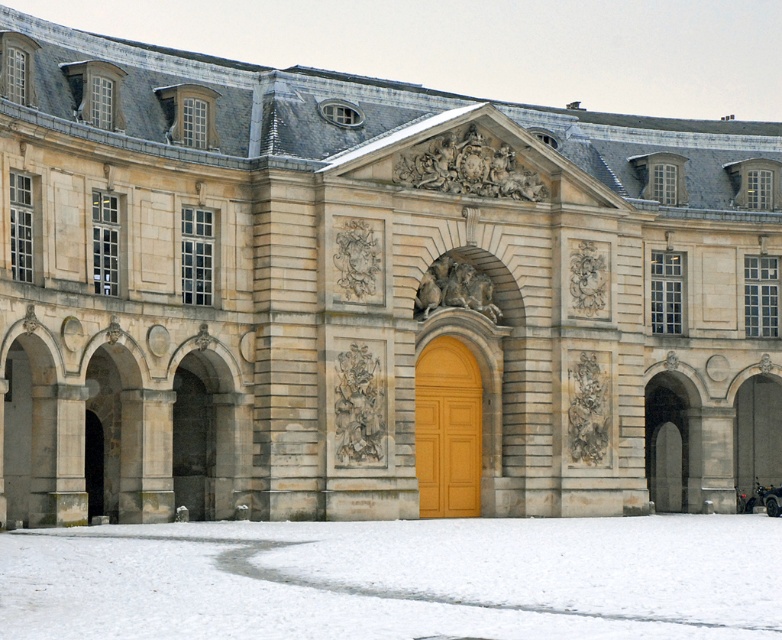
This screenshot has height=640, width=782. I want to click on white powdery snow at lower center, so click(x=397, y=579).